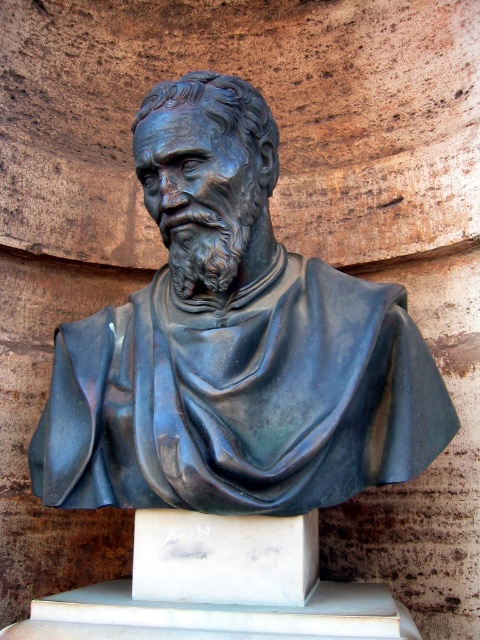
Does bronze statue at center appear on the right side of white marble pedestal at center?

In fact, bronze statue at center is to the left of white marble pedestal at center.

Which is above, bronze statue at center or white marble pedestal at center?

bronze statue at center

Between point (300, 337) and point (312, 577), which one is positioned in front?

Point (300, 337)

I want to click on bronze statue at center, so click(x=232, y=346).